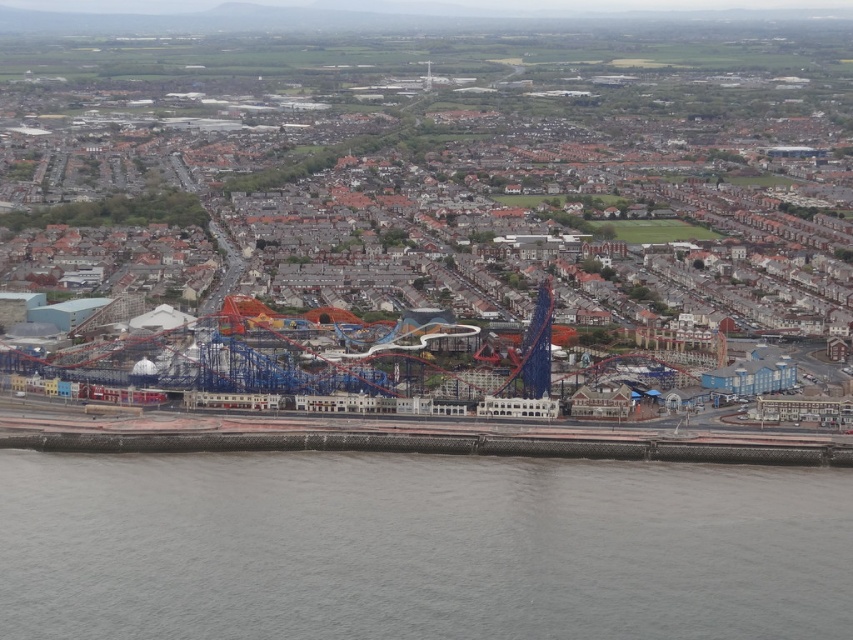
Based on the photo, which is below, blue metallic roller coaster at center or gray concrete wall at lower center?

Positioned lower is gray concrete wall at lower center.

Does blue metallic roller coaster at center have a greater width compared to gray concrete wall at lower center?

Indeed, blue metallic roller coaster at center has a greater width compared to gray concrete wall at lower center.

Which is behind, point (805, 266) or point (1, 621)?

The point (805, 266) is behind.

Identify the location of blue metallic roller coaster at center. (450, 202).